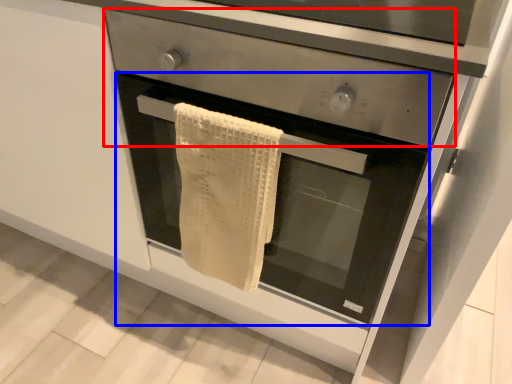
Question: Which object is further to the camera taking this photo, drawer (highlighted by a red box) or oven (highlighted by a blue box)?

Choices:
 (A) drawer
 (B) oven

Answer: (B)